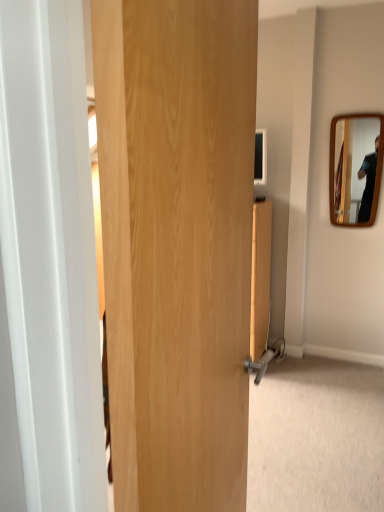
Where is `wooden mirror at right`? The image size is (384, 512). wooden mirror at right is located at coordinates (355, 168).

The width and height of the screenshot is (384, 512). What do you see at coordinates (355, 168) in the screenshot?
I see `wooden mirror at right` at bounding box center [355, 168].

In order to face wooden door at center, should I rotate leftwards or rightwards?

You should rotate right by 0.933 degrees.

Describe the element at coordinates (177, 244) in the screenshot. I see `wooden door at center` at that location.

Image resolution: width=384 pixels, height=512 pixels. I want to click on wooden door at center, so click(x=177, y=244).

Where is `wooden mirror at right`? wooden mirror at right is located at coordinates (355, 168).

Can you confirm if wooden door at center is positioned to the left of wooden mirror at right?

Correct, you'll find wooden door at center to the left of wooden mirror at right.

Considering the positions of objects wooden door at center and wooden mirror at right in the image provided, who is in front, wooden door at center or wooden mirror at right?

wooden door at center is more forward.

Is point (205, 399) farther from viewer compared to point (356, 160)?

No, (205, 399) is in front of (356, 160).

From the image's perspective, is wooden door at center located above or below wooden mirror at right?

Clearly, from the image's perspective, wooden door at center is below wooden mirror at right.

From a real-world perspective, who is located higher, wooden door at center or wooden mirror at right?

wooden mirror at right is physically above.

Between wooden door at center and wooden mirror at right, which one has larger width?

wooden door at center.

In the scene shown: Considering the sizes of objects wooden door at center and wooden mirror at right in the image provided, who is taller, wooden door at center or wooden mirror at right?

With more height is wooden door at center.

Does wooden door at center have a smaller size compared to wooden mirror at right?

Actually, wooden door at center might be larger than wooden mirror at right.

Is wooden door at center situated inside wooden mirror at right or outside?

wooden door at center exists outside the volume of wooden mirror at right.

Would you consider wooden door at center to be distant from wooden mirror at right?

That's right, there is a large distance between wooden door at center and wooden mirror at right.

Looking at this image, is wooden door at center aimed at wooden mirror at right?

No, wooden door at center is not aimed at wooden mirror at right.

Based on the photo, how different are the orientations of wooden door at center and wooden mirror at right in degrees?

90 degrees separate the facing orientations of wooden door at center and wooden mirror at right.

Identify the location of mirror that appears on the right of wooden door at center. This screenshot has width=384, height=512. (x=355, y=168).

Can you confirm if wooden mirror at right is positioned to the left of wooden door at center?

No, wooden mirror at right is not to the left of wooden door at center.

Is the depth of wooden mirror at right greater than that of wooden door at center?

Yes, wooden mirror at right is further from the camera.

Is point (360, 138) positioned in front of point (179, 8)?

No, (360, 138) is behind (179, 8).

From the image's perspective, is wooden mirror at right above wooden door at center?

Yes, from the image's perspective, wooden mirror at right is on top of wooden door at center.

From a real-world perspective, between wooden mirror at right and wooden door at center, who is vertically lower?

From a 3D spatial view, wooden door at center is below.

Can you confirm if wooden mirror at right is wider than wooden door at center?

A: In fact, wooden mirror at right might be narrower than wooden door at center.

Considering the sizes of objects wooden mirror at right and wooden door at center in the image provided, who is taller, wooden mirror at right or wooden door at center?

wooden door at center is taller.

Does wooden mirror at right have a larger size compared to wooden door at center?

No, wooden mirror at right is not bigger than wooden door at center.

Can wooden door at center be found inside wooden mirror at right?

No.

Is wooden mirror at right placed right next to wooden door at center?

There is a gap between wooden mirror at right and wooden door at center.

Is wooden door at center at the back of wooden mirror at right?

No, wooden mirror at right's orientation is not away from wooden door at center.

How many degrees apart are the facing directions of wooden mirror at right and wooden door at center?

Answer: 90 degrees separate the facing orientations of wooden mirror at right and wooden door at center.

Identify the location of mirror to the right of wooden door at center. (355, 168).

Locate an element on the screen. This screenshot has height=512, width=384. door lying in front of the wooden mirror at right is located at coordinates (177, 244).

Where is `mirror on the right side of wooden door at center`? The image size is (384, 512). mirror on the right side of wooden door at center is located at coordinates (355, 168).